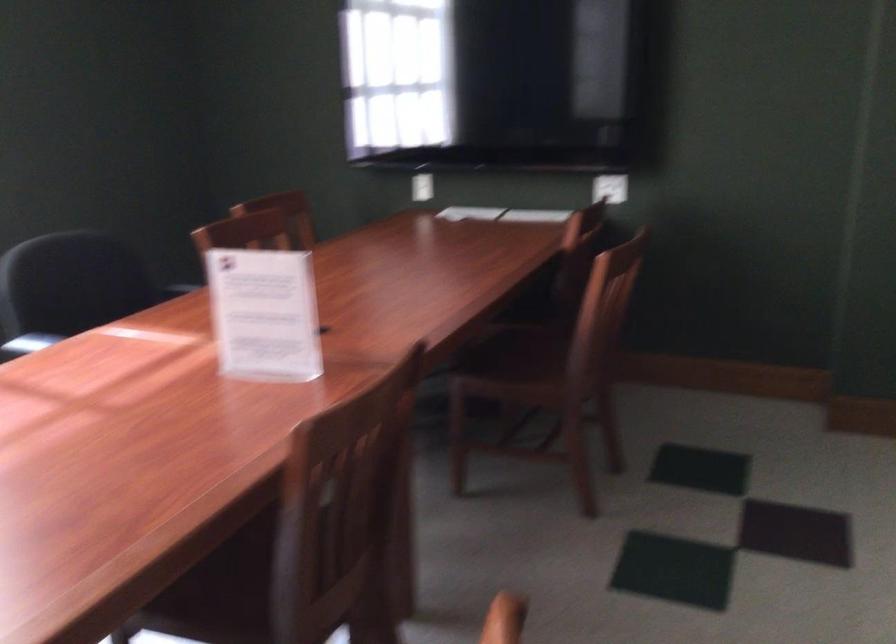
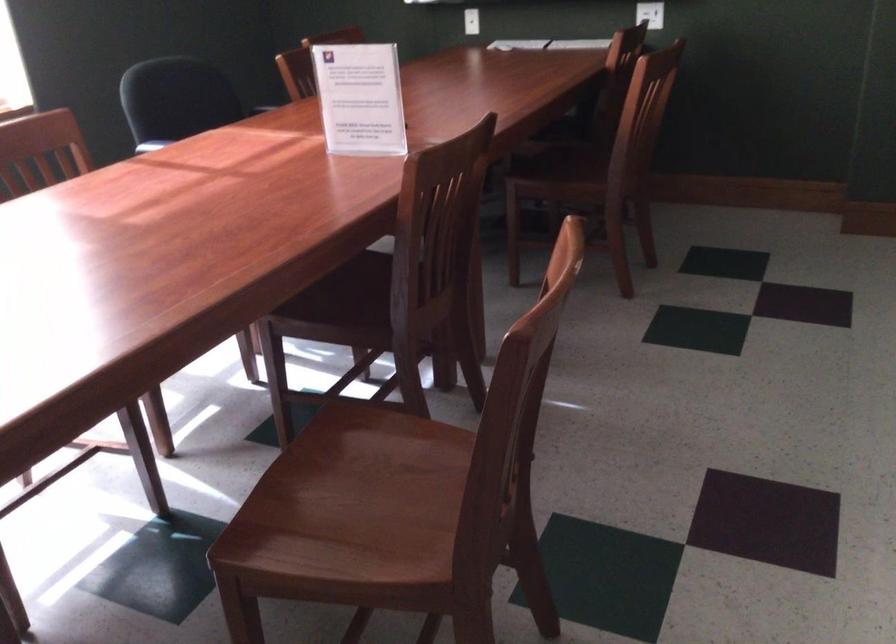
Locate, in the second image, the point that corresponds to (613,192) in the first image.

(650, 14)